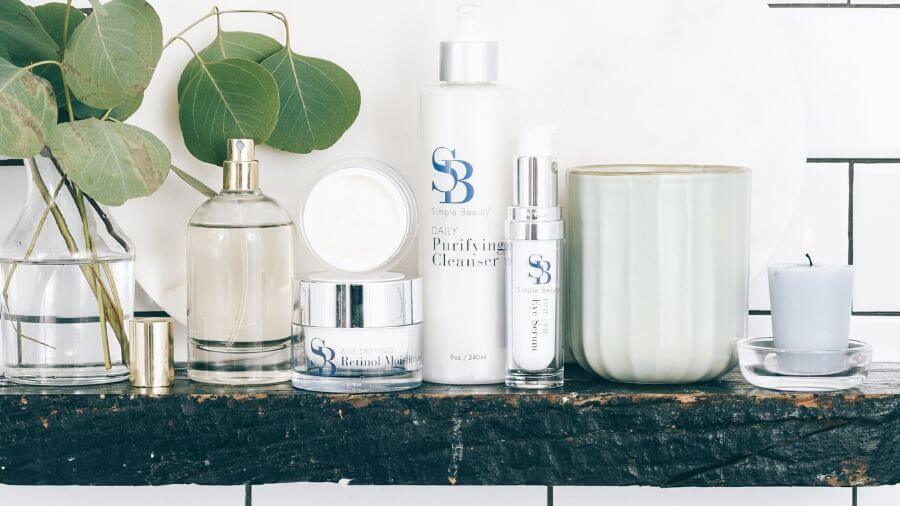
Image resolution: width=900 pixels, height=506 pixels. What are the coordinates of `wall` in the screenshot? It's located at (615, 70).